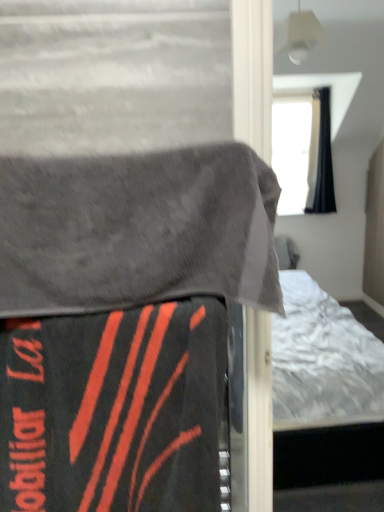
The image size is (384, 512). Identify the location of velvet-like black bed at center. (124, 321).

The width and height of the screenshot is (384, 512). Find the location of `black matte blanket at lower left, positioned as the second blanket in top-to-bottom order`. black matte blanket at lower left, positioned as the second blanket in top-to-bottom order is located at coordinates pyautogui.click(x=113, y=409).

Considering the relative sizes of black matte blanket at lower left, positioned as the second blanket in top-to-bottom order, and velvet-like black bed at center in the image provided, is black matte blanket at lower left, positioned as the second blanket in top-to-bottom order, thinner than velvet-like black bed at center?

In fact, black matte blanket at lower left, positioned as the second blanket in top-to-bottom order, might be wider than velvet-like black bed at center.

Can you confirm if black matte blanket at lower left, the 1th blanket from the bottom, is bigger than velvet-like black bed at center?

No, black matte blanket at lower left, the 1th blanket from the bottom, is not bigger than velvet-like black bed at center.

Is black matte blanket at lower left, positioned as the second blanket in top-to-bottom order, positioned far away from velvet-like black bed at center?

black matte blanket at lower left, positioned as the second blanket in top-to-bottom order, is actually quite close to velvet-like black bed at center.

From the image's perspective, which is below, black matte blanket at lower left, positioned as the second blanket in top-to-bottom order, or velvet-like black bed at center?

black matte blanket at lower left, positioned as the second blanket in top-to-bottom order, from the image's perspective.

Find the location of a particular element. Image resolution: width=384 pixels, height=512 pixels. blanket on the right of black matte blanket at lower left, the 1th blanket from the bottom is located at coordinates 137,230.

Can you confirm if gray fabric blanket at upper left, placed as the 2th blanket when sorted from bottom to top, is smaller than black matte blanket at lower left, the 1th blanket from the bottom?

Actually, gray fabric blanket at upper left, placed as the 2th blanket when sorted from bottom to top, might be larger than black matte blanket at lower left, the 1th blanket from the bottom.

Does gray fabric blanket at upper left, placed as the 2th blanket when sorted from bottom to top, lie behind black matte blanket at lower left, positioned as the second blanket in top-to-bottom order?

No, gray fabric blanket at upper left, placed as the 2th blanket when sorted from bottom to top, is closer to the viewer.

From the image's perspective, does velvet-like black bed at center appear higher than black matte blanket at lower left, the 1th blanket from the bottom?

Indeed, from the image's perspective, velvet-like black bed at center is shown above black matte blanket at lower left, the 1th blanket from the bottom.

Considering the sizes of objects velvet-like black bed at center and black matte blanket at lower left, positioned as the second blanket in top-to-bottom order, in the image provided, who is shorter, velvet-like black bed at center or black matte blanket at lower left, positioned as the second blanket in top-to-bottom order,?

black matte blanket at lower left, positioned as the second blanket in top-to-bottom order.

Is velvet-like black bed at center located outside black matte blanket at lower left, positioned as the second blanket in top-to-bottom order?

Indeed, velvet-like black bed at center is completely outside black matte blanket at lower left, positioned as the second blanket in top-to-bottom order.

Does point (76, 258) appear closer or farther from the camera than point (111, 424)?

Point (76, 258) is closer to the camera than point (111, 424).

In terms of width, does black matte blanket at lower left, positioned as the second blanket in top-to-bottom order, look wider or thinner when compared to gray fabric blanket at upper left, placed as the 2th blanket when sorted from bottom to top?

Considering their sizes, black matte blanket at lower left, positioned as the second blanket in top-to-bottom order, looks slimmer than gray fabric blanket at upper left, placed as the 2th blanket when sorted from bottom to top.

Is point (11, 341) less distant than point (157, 288)?

Yes, point (11, 341) is closer to viewer.

Considering the sizes of objects black matte blanket at lower left, the 1th blanket from the bottom, and gray fabric blanket at upper left, placed as the 2th blanket when sorted from bottom to top, in the image provided, who is shorter, black matte blanket at lower left, the 1th blanket from the bottom, or gray fabric blanket at upper left, placed as the 2th blanket when sorted from bottom to top,?

Standing shorter between the two is gray fabric blanket at upper left, placed as the 2th blanket when sorted from bottom to top.

From a real-world perspective, is black matte blanket at lower left, positioned as the second blanket in top-to-bottom order, positioned under gray fabric blanket at upper left, the first blanket in the top-to-bottom sequence, based on gravity?

Yes, from a real-world perspective, black matte blanket at lower left, positioned as the second blanket in top-to-bottom order, is below gray fabric blanket at upper left, the first blanket in the top-to-bottom sequence.

Is gray fabric blanket at upper left, the first blanket in the top-to-bottom sequence, surrounding velvet-like black bed at center?

Yes, gray fabric blanket at upper left, the first blanket in the top-to-bottom sequence, contains velvet-like black bed at center.

Is gray fabric blanket at upper left, placed as the 2th blanket when sorted from bottom to top, thinner than velvet-like black bed at center?

No.

From the picture: Relative to gray fabric blanket at upper left, the first blanket in the top-to-bottom sequence, is velvet-like black bed at center in front or behind?

Clearly, velvet-like black bed at center is behind gray fabric blanket at upper left, the first blanket in the top-to-bottom sequence.

From a real-world perspective, which is physically above, velvet-like black bed at center or gray fabric blanket at upper left, placed as the 2th blanket when sorted from bottom to top?

gray fabric blanket at upper left, placed as the 2th blanket when sorted from bottom to top, from a real-world perspective.

From the image's perspective, is velvet-like black bed at center located above gray fabric blanket at upper left, the first blanket in the top-to-bottom sequence?

No, from the image's perspective, velvet-like black bed at center is not above gray fabric blanket at upper left, the first blanket in the top-to-bottom sequence.

Is velvet-like black bed at center positioned with its back to gray fabric blanket at upper left, the first blanket in the top-to-bottom sequence?

Yes, velvet-like black bed at center is positioned with its back facing gray fabric blanket at upper left, the first blanket in the top-to-bottom sequence.

Where is `the 1st blanket in front of the velvet-like black bed at center`? This screenshot has width=384, height=512. the 1st blanket in front of the velvet-like black bed at center is located at coordinates (113, 409).

Identify the location of blanket located above the black matte blanket at lower left, the 1th blanket from the bottom (from the image's perspective). tap(137, 230).

Considering their positions, is gray fabric blanket at upper left, the first blanket in the top-to-bottom sequence, positioned further to black matte blanket at lower left, positioned as the second blanket in top-to-bottom order, than velvet-like black bed at center?

gray fabric blanket at upper left, the first blanket in the top-to-bottom sequence.

From the image, which object appears to be nearer to velvet-like black bed at center, black matte blanket at lower left, the 1th blanket from the bottom, or gray fabric blanket at upper left, the first blanket in the top-to-bottom sequence?

black matte blanket at lower left, the 1th blanket from the bottom, is closer to velvet-like black bed at center.

Looking at the image, which one is located closer to velvet-like black bed at center, gray fabric blanket at upper left, the first blanket in the top-to-bottom sequence, or black matte blanket at lower left, positioned as the second blanket in top-to-bottom order?

Based on the image, black matte blanket at lower left, positioned as the second blanket in top-to-bottom order, appears to be nearer to velvet-like black bed at center.

Estimate the real-world distances between objects in this image. Which object is further from gray fabric blanket at upper left, the first blanket in the top-to-bottom sequence, velvet-like black bed at center or black matte blanket at lower left, the 1th blanket from the bottom?

The object further to gray fabric blanket at upper left, the first blanket in the top-to-bottom sequence, is black matte blanket at lower left, the 1th blanket from the bottom.

Which object lies nearer to the anchor point gray fabric blanket at upper left, the first blanket in the top-to-bottom sequence, black matte blanket at lower left, positioned as the second blanket in top-to-bottom order, or velvet-like black bed at center?

The object closer to gray fabric blanket at upper left, the first blanket in the top-to-bottom sequence, is velvet-like black bed at center.

Based on their spatial positions, is velvet-like black bed at center or gray fabric blanket at upper left, the first blanket in the top-to-bottom sequence, further from black matte blanket at lower left, positioned as the second blanket in top-to-bottom order?

gray fabric blanket at upper left, the first blanket in the top-to-bottom sequence, is positioned further to the anchor black matte blanket at lower left, positioned as the second blanket in top-to-bottom order.

This screenshot has width=384, height=512. I want to click on bed between gray fabric blanket at upper left, placed as the 2th blanket when sorted from bottom to top, and black matte blanket at lower left, the 1th blanket from the bottom, from top to bottom, so pyautogui.click(x=124, y=321).